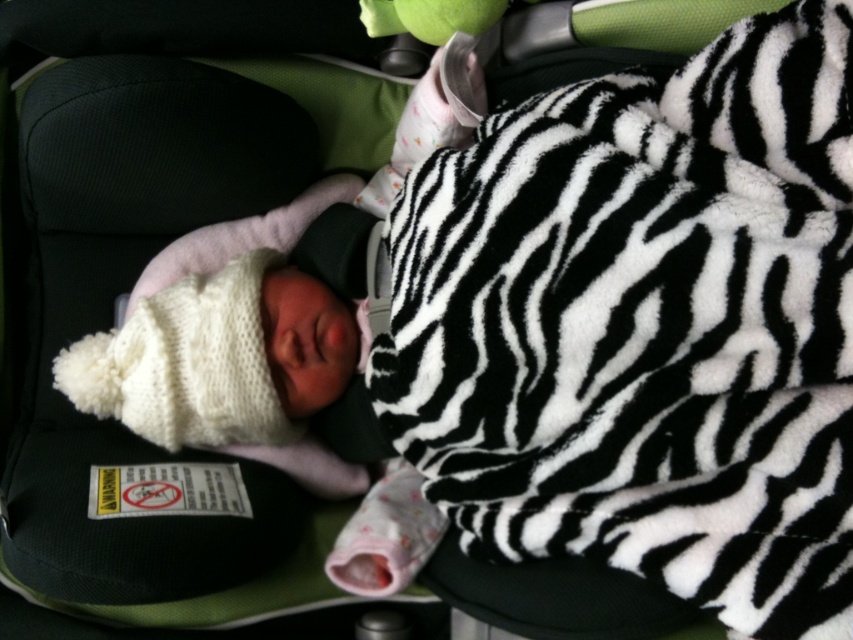
Question: Which point is farther to the camera?

Choices:
 (A) white knitted hat at center
 (B) zebra-patterned fleece blanket at center

Answer: (A)

Question: Can you confirm if zebra-patterned fleece blanket at center is positioned above white knitted hat at center?

Choices:
 (A) no
 (B) yes

Answer: (B)

Question: Which point appears closest to the camera in this image?

Choices:
 (A) (701, 604)
 (B) (219, 417)

Answer: (A)

Question: Is zebra-patterned fleece blanket at center wider than white knitted hat at center?

Choices:
 (A) no
 (B) yes

Answer: (B)

Question: Which point is farther to the camera?

Choices:
 (A) (219, 289)
 (B) (430, 272)

Answer: (A)

Question: From the image, what is the correct spatial relationship of zebra-patterned fleece blanket at center in relation to white knitted hat at center?

Choices:
 (A) right
 (B) left

Answer: (A)